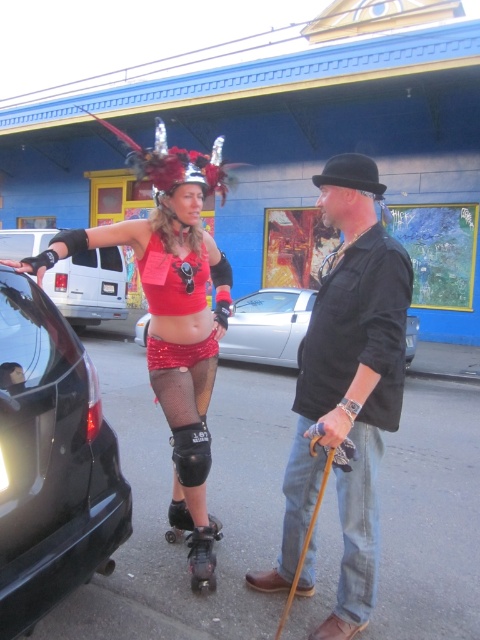
You are standing in the parking lot and want to determine which of the two points, point (146, 298) or point (252, 296), is closer to you. Based on the scene, which point is nearer?

Point (146, 298) is closer to the camera than point (252, 296), so it is the nearer point.

You are a delivery person trying to place a package between the black matte knee pad at center and the shiny black roller skate at center. The package is 16 inches long. Will it fit in the space between them?

The distance between the black matte knee pad at center and the shiny black roller skate at center is 15.50 inches. Since the package is 16 inches long, it will not fit in the space between them.